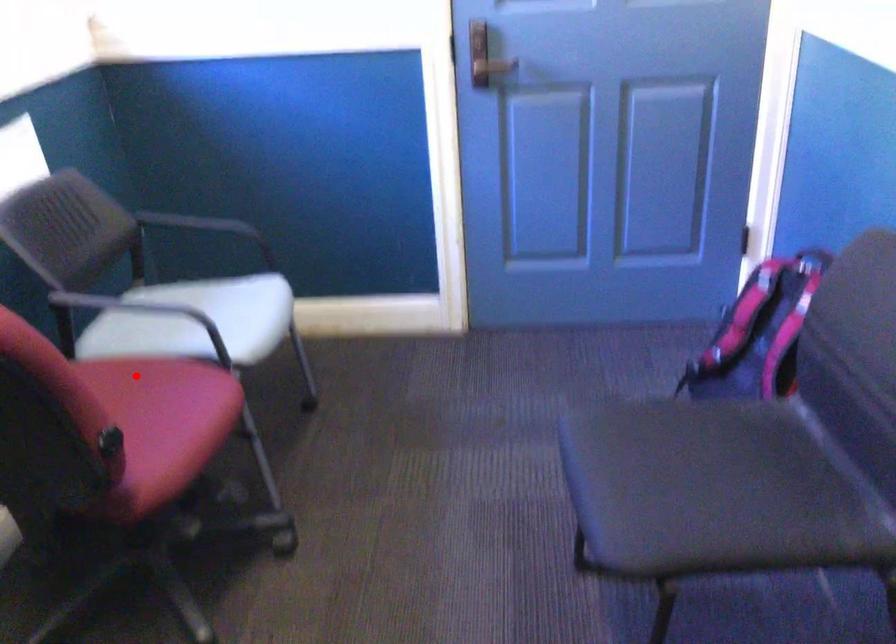
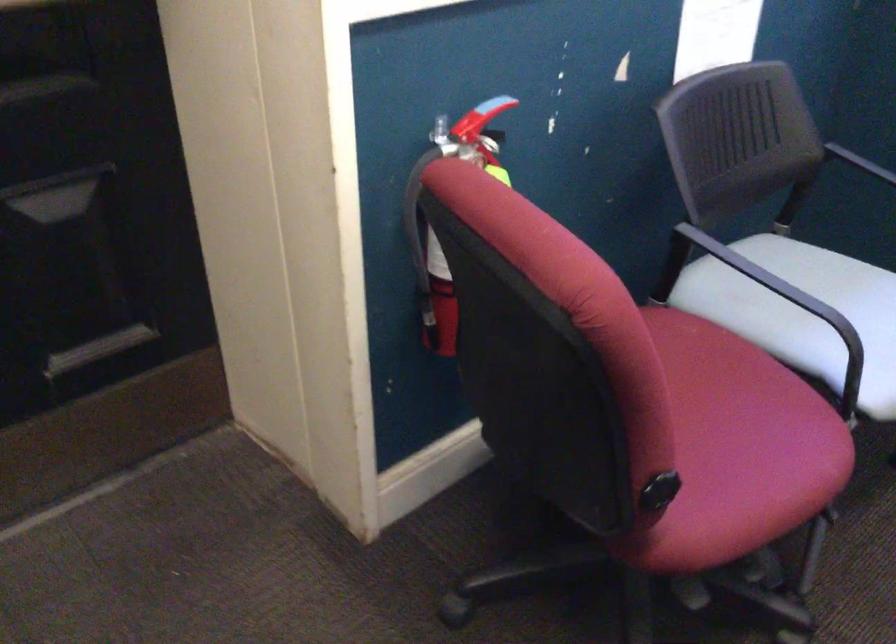
Question: I am providing you with two images of the same scene from different viewpoints. A red point is shown in image1. For the corresponding object point in image2, is it positioned nearer or farther from the camera?

Choices:
 (A) Nearer
 (B) Farther

Answer: (A)